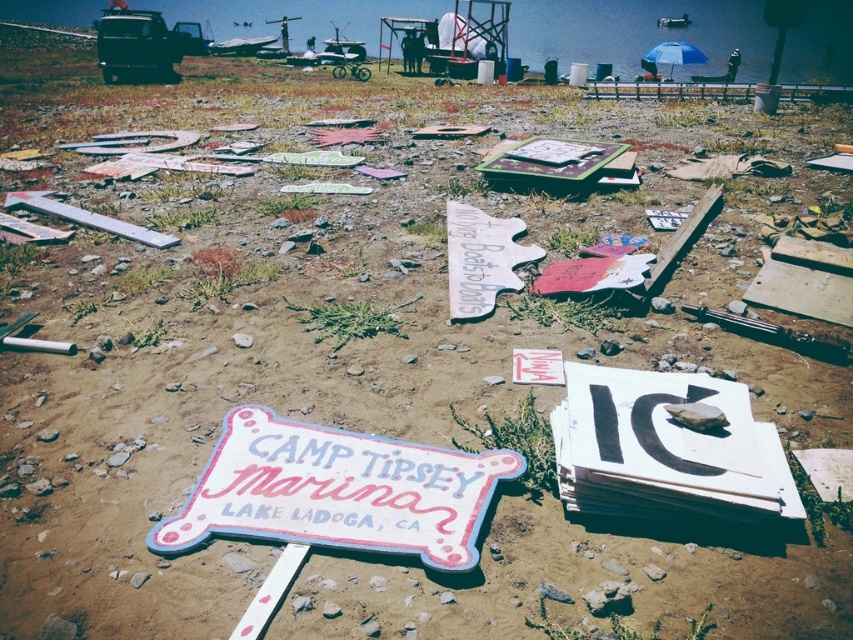
Who is positioned more to the right, white painted wood sign at center or blue fabric umbrella at upper right?

blue fabric umbrella at upper right

Who is shorter, white painted wood sign at center or blue fabric umbrella at upper right?

Standing shorter between the two is white painted wood sign at center.

You are a GUI agent. You are given a task and a screenshot of the screen. Output one action in this format:
    pyautogui.click(x=<x>, y=<y>)
    Task: Click on the white painted wood sign at center
    The image size is (853, 640).
    Given the screenshot: What is the action you would take?
    pyautogui.click(x=482, y=259)

Can you confirm if pastel painted wooden sign at center is smaller than white painted wood sign at center?

Yes.

Looking at this image, does pastel painted wooden sign at center appear over white painted wood sign at center?

A: Actually, pastel painted wooden sign at center is below white painted wood sign at center.

You are a GUI agent. You are given a task and a screenshot of the screen. Output one action in this format:
    pyautogui.click(x=<x>, y=<y>)
    Task: Click on the pastel painted wooden sign at center
    The image size is (853, 640).
    Given the screenshot: What is the action you would take?
    pyautogui.click(x=337, y=492)

The height and width of the screenshot is (640, 853). What are the coordinates of `pastel painted wooden sign at center` in the screenshot? It's located at (337, 492).

Does pastel painted wooden sign at center lie in front of blue fabric umbrella at upper right?

Yes, it is.

Measure the distance between point (225,504) and camera.

6.48 feet

Who is more forward, (416,541) or (671,60)?

Point (416,541) is more forward.

The height and width of the screenshot is (640, 853). In order to click on pastel painted wooden sign at center in this screenshot , I will do `click(337, 492)`.